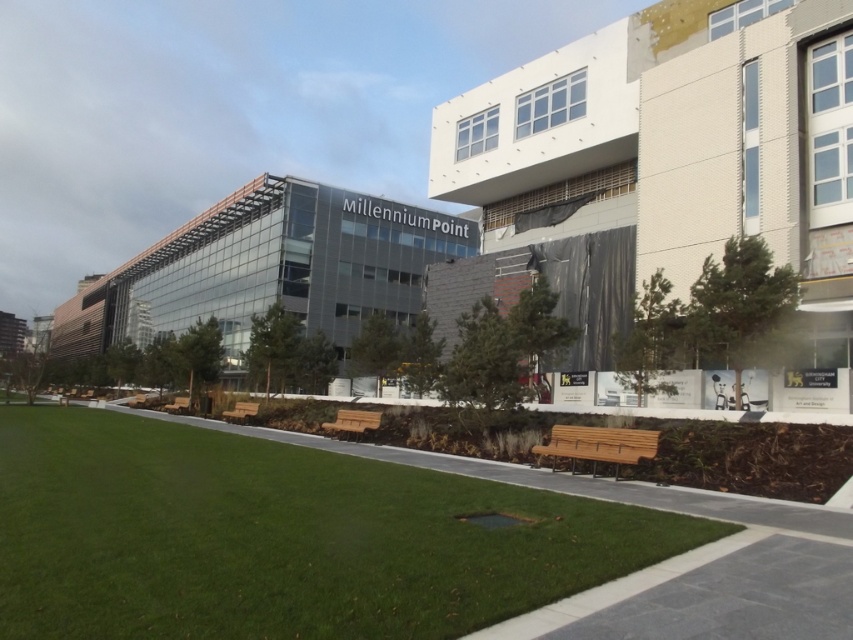
Between wooden park bench at center and wooden bench at center, which one is positioned lower?

wooden bench at center

Between point (334, 426) and point (253, 413), which one is positioned behind?

The point (253, 413) is more distant.

This screenshot has height=640, width=853. In order to click on wooden park bench at center in this screenshot , I will do `click(352, 420)`.

Which is more to the right, green grass at center or wooden bench at center?

green grass at center is more to the right.

Looking at this image, is green grass at center thinner than wooden bench at center?

Incorrect, green grass at center's width is not less than wooden bench at center's.

Does point (85, 460) come in front of point (225, 417)?

Yes, point (85, 460) is in front of point (225, 417).

Where is `green grass at center`? green grass at center is located at coordinates (280, 538).

Does green grass at center have a greater width compared to wooden bench at lower right?

Yes, green grass at center is wider than wooden bench at lower right.

Who is higher up, green grass at center or wooden bench at lower right?

Positioned higher is wooden bench at lower right.

Between point (74, 595) and point (556, 442), which one is positioned behind?

Point (556, 442)

Identify the location of green grass at center. click(x=280, y=538).